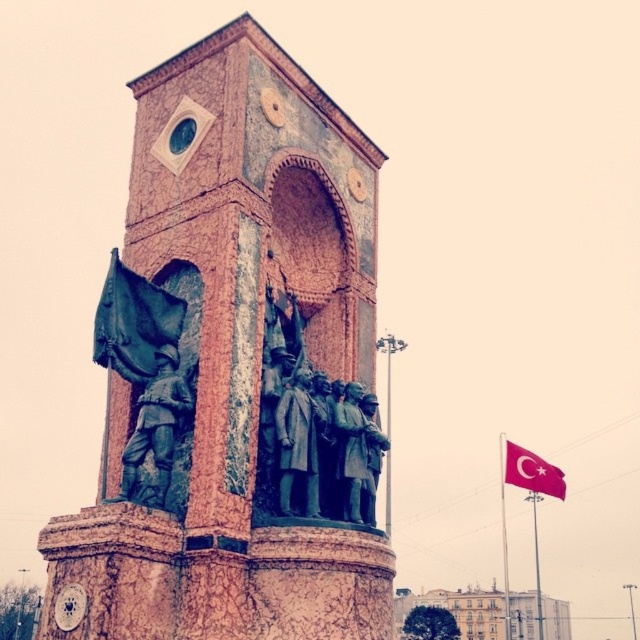
Is rustic stone tower at center above red fabric flag at right?

Yes, rustic stone tower at center is above red fabric flag at right.

Is rustic stone tower at center bigger than red fabric flag at right?

Yes.

What do you see at coordinates (230, 368) in the screenshot?
I see `rustic stone tower at center` at bounding box center [230, 368].

Identify the location of rustic stone tower at center. (230, 368).

Does green patina statue at center come in front of red fabric flag at right?

Yes, green patina statue at center is closer to the viewer.

Can you confirm if green patina statue at center is positioned to the left of red fabric flag at right?

Yes, green patina statue at center is to the left of red fabric flag at right.

Does point (140, 376) come closer to viewer compared to point (541, 470)?

Yes.

In order to click on green patina statue at center in this screenshot , I will do `click(156, 428)`.

Between rustic stone tower at center and green patina statue at center, which one appears on the right side from the viewer's perspective?

Positioned to the right is rustic stone tower at center.

Can you confirm if rustic stone tower at center is positioned to the right of green patina statue at center?

Indeed, rustic stone tower at center is positioned on the right side of green patina statue at center.

Between point (172, 525) and point (166, 429), which one is positioned in front?

Point (172, 525)

Where is `rustic stone tower at center`? This screenshot has width=640, height=640. rustic stone tower at center is located at coordinates (230, 368).